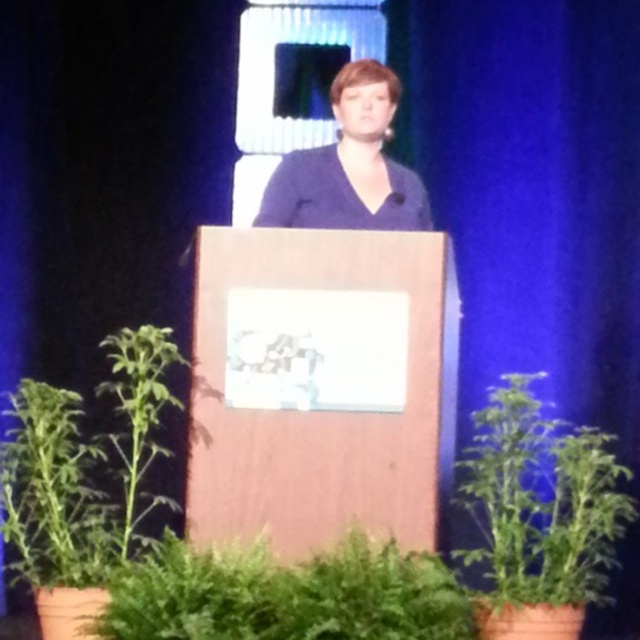
Does green leafy plant at lower left appear under blue matte dress at center?

Indeed, green leafy plant at lower left is positioned under blue matte dress at center.

Does green leafy plant at lower left have a smaller size compared to blue matte dress at center?

Incorrect, green leafy plant at lower left is not smaller in size than blue matte dress at center.

Who is more forward, (120, 442) or (282, 173)?

Point (120, 442) is in front.

The height and width of the screenshot is (640, 640). Find the location of `green leafy plant at lower left`. green leafy plant at lower left is located at coordinates (84, 467).

In the scene shown: Which of these two, green leafy plant at lower center or green leafy plant at lower left, stands shorter?

Standing shorter between the two is green leafy plant at lower center.

The height and width of the screenshot is (640, 640). Find the location of `green leafy plant at lower center`. green leafy plant at lower center is located at coordinates (285, 595).

Can you confirm if green leafy plant at lower center is taller than green leafy plant at lower right?

No, green leafy plant at lower center is not taller than green leafy plant at lower right.

Where is `green leafy plant at lower center`? The width and height of the screenshot is (640, 640). green leafy plant at lower center is located at coordinates (285, 595).